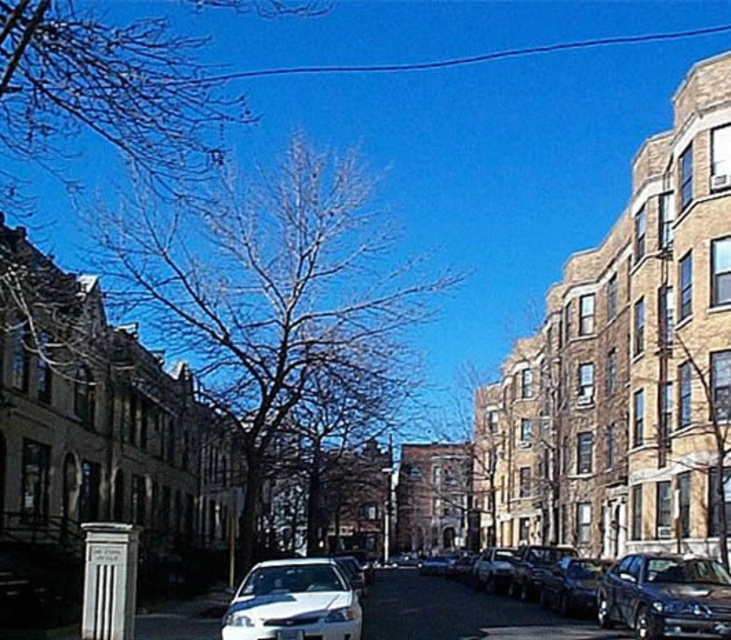
You are a delivery driver trying to park your vehicle in this street. You see a shiny silver sedan at center and a white glossy car at center. Which car is positioned more to the right side of the street?

The shiny silver sedan at center is positioned more to the right side of the street because it is to the right of the white glossy car at center.

You are standing on the sidewalk of the urban street scene and want to cross the street to reach the shiny black sedan at lower right. The crosswalk is 50 feet away from you. Can you safely reach the sedan without walking further than the crosswalk?

The shiny black sedan at lower right is 52.95 feet away from you. Since the crosswalk is only 50 feet away, you would need to walk an additional 2.95 feet beyond the crosswalk to reach the sedan. Therefore, you cannot safely reach it without going past the crosswalk.